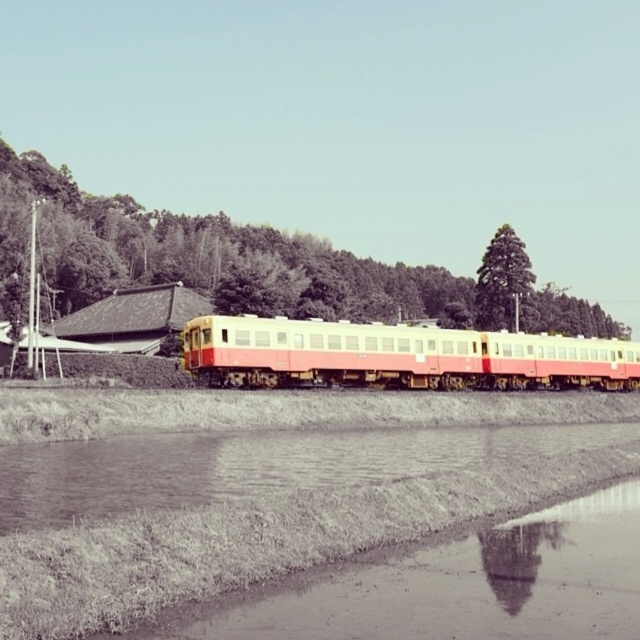
Question: Can you confirm if matte pink and cream passenger train at center is positioned to the right of green leafy tree at upper center?

Choices:
 (A) no
 (B) yes

Answer: (A)

Question: Estimate the real-world distances between objects in this image. Which object is farther from the green leafy tree at center?

Choices:
 (A) green leafy tree at upper center
 (B) matte pink and cream passenger train at center

Answer: (B)

Question: Which object appears closest to the camera in this image?

Choices:
 (A) matte pink and cream passenger train at center
 (B) green leafy tree at center
 (C) green leafy tree at upper center

Answer: (A)

Question: Estimate the real-world distances between objects in this image. Which object is closer to the green leafy tree at upper center?

Choices:
 (A) matte pink and cream passenger train at center
 (B) green leafy tree at center

Answer: (B)

Question: Is green leafy tree at center bigger than matte pink and cream passenger train at center?

Choices:
 (A) no
 (B) yes

Answer: (B)

Question: In this image, where is matte pink and cream passenger train at center located relative to green leafy tree at upper center?

Choices:
 (A) right
 (B) left

Answer: (B)